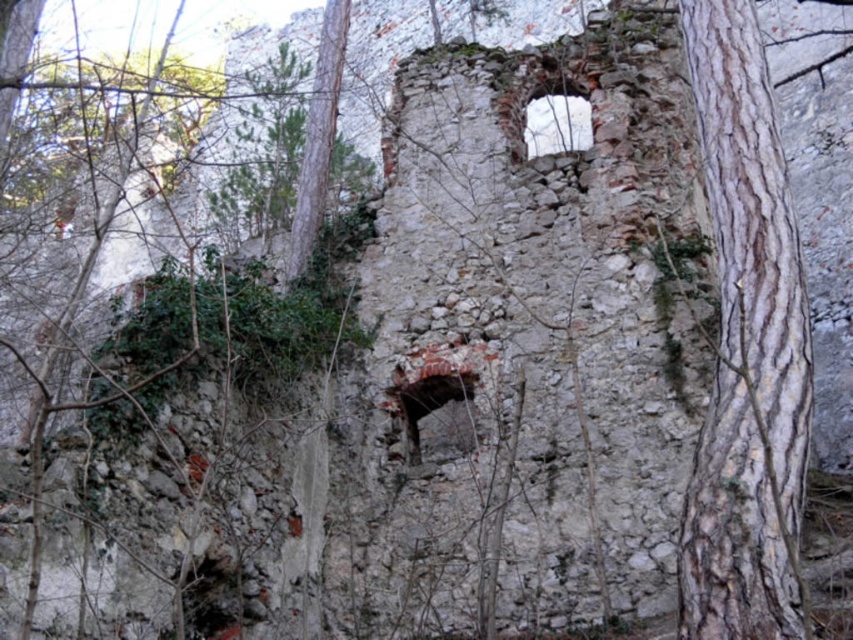
Based on the photo, is smooth bark tree trunk at right smaller than smooth brown bark at center?

No, smooth bark tree trunk at right is not smaller than smooth brown bark at center.

The image size is (853, 640). Find the location of `smooth bark tree trunk at right`. smooth bark tree trunk at right is located at coordinates (746, 353).

Identify the location of smooth bark tree trunk at right. The image size is (853, 640). (746, 353).

Between smooth brown bark at center and dark brown stone hole at center, which one is positioned higher?

smooth brown bark at center is higher up.

Is smooth brown bark at center above dark brown stone hole at center?

Indeed, smooth brown bark at center is positioned over dark brown stone hole at center.

Is point (308, 186) positioned before point (456, 445)?

No, it is not.

Find the location of a particular element. Image resolution: width=853 pixels, height=640 pixels. smooth brown bark at center is located at coordinates (317, 138).

Between point (335, 60) and point (207, 563), which one is positioned behind?

The point (335, 60) is behind.

Locate an element on the screen. The width and height of the screenshot is (853, 640). smooth brown bark at center is located at coordinates pyautogui.click(x=317, y=138).

The image size is (853, 640). Identify the location of smooth brown bark at center. (317, 138).